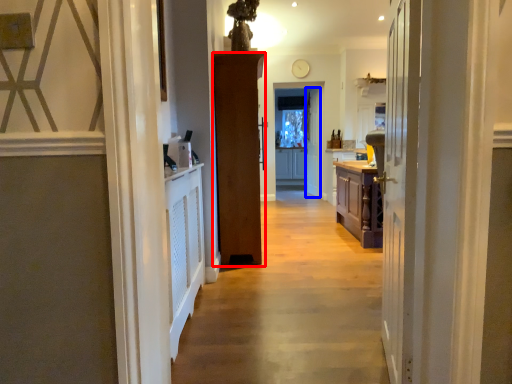
Question: Which object appears farthest to the camera in this image, door (highlighted by a red box) or door (highlighted by a blue box)?

Choices:
 (A) door
 (B) door

Answer: (B)